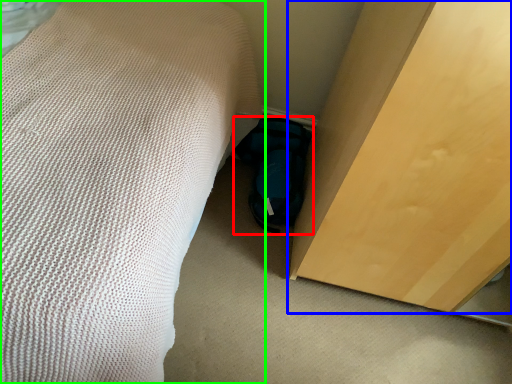
Question: Which is farther away from footwear (highlighted by a red box)? furniture (highlighted by a blue box) or bed (highlighted by a green box)?

Choices:
 (A) furniture
 (B) bed

Answer: (B)